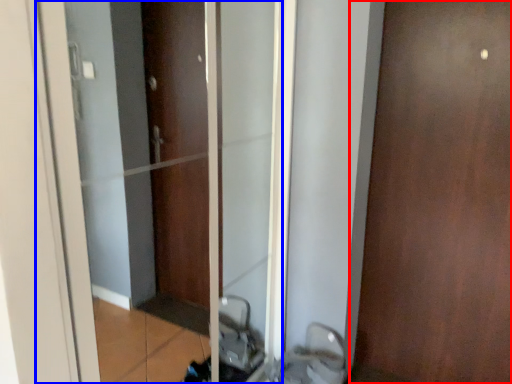
Question: Which object appears closest to the camera in this image, door (highlighted by a red box) or elevator (highlighted by a blue box)?

Choices:
 (A) door
 (B) elevator

Answer: (B)